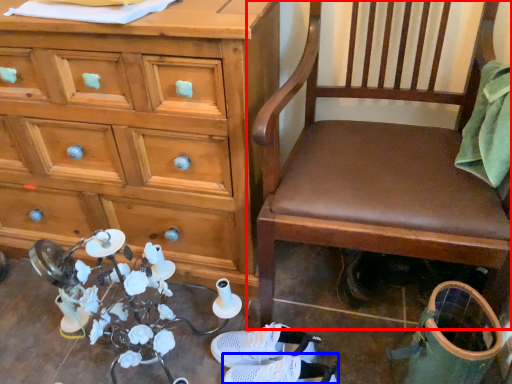
Question: Which object is closer to the camera taking this photo, chair (highlighted by a red box) or footwear (highlighted by a blue box)?

Choices:
 (A) chair
 (B) footwear

Answer: (A)